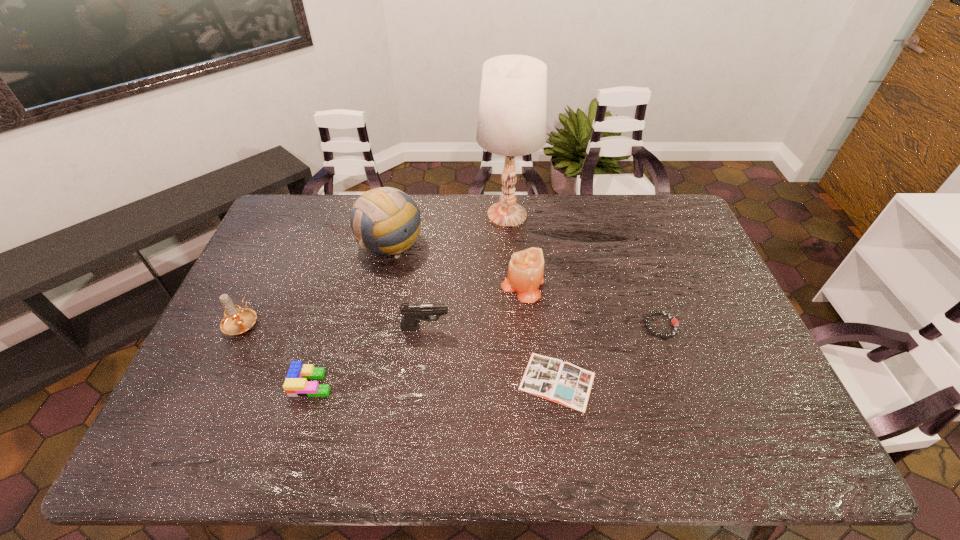
Find the location of a particular element. This screenshot has height=540, width=960. the shortest object is located at coordinates (561, 382).

Identify the location of vacant region located 0.100m on the left of the tallest object. This screenshot has height=540, width=960. (449, 214).

Locate an element on the screen. free location located on the left of the volleyball is located at coordinates (334, 244).

Where is `vacant area located 0.190m on the front of the third farthest object`? vacant area located 0.190m on the front of the third farthest object is located at coordinates (529, 358).

The image size is (960, 540). I want to click on vacant space located on the back of the leftmost object, so click(x=274, y=255).

Image resolution: width=960 pixels, height=540 pixels. Find the location of `vacant space located at the barrel of the pistol`. vacant space located at the barrel of the pistol is located at coordinates (584, 327).

Where is `free space located 0.100m on the back of the Lego`? Image resolution: width=960 pixels, height=540 pixels. free space located 0.100m on the back of the Lego is located at coordinates (325, 340).

Where is `vacant area situated 0.150m on the left of the second shortest object`? vacant area situated 0.150m on the left of the second shortest object is located at coordinates (591, 326).

Where is `vacant space located on the left of the shortest object`? vacant space located on the left of the shortest object is located at coordinates (483, 381).

Image resolution: width=960 pixels, height=540 pixels. Find the location of `lamp present at the far edge`. lamp present at the far edge is located at coordinates (512, 111).